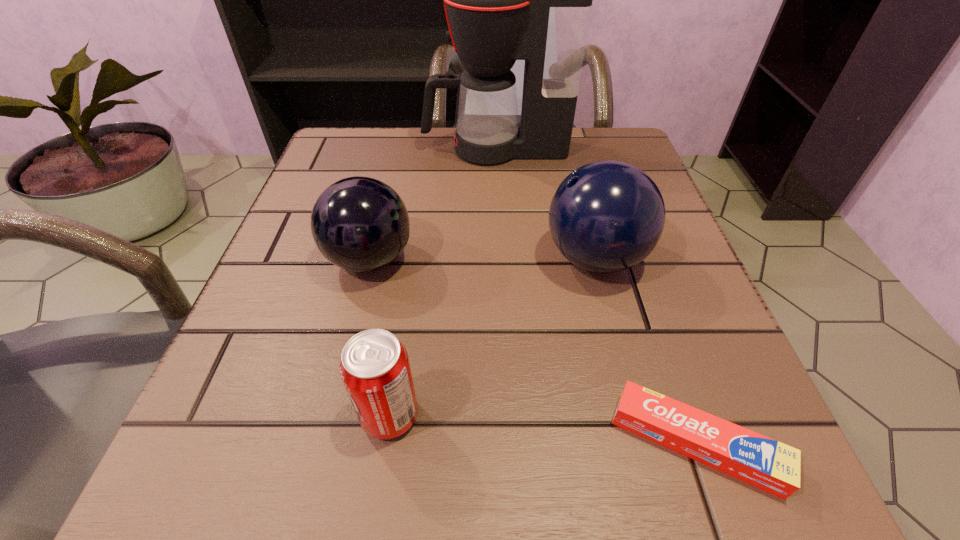
This screenshot has height=540, width=960. What are the coordinates of `the tallest object` in the screenshot? It's located at (505, 0).

Where is `the farthest object`? This screenshot has height=540, width=960. the farthest object is located at coordinates (505, 0).

The width and height of the screenshot is (960, 540). I want to click on the right bowling ball, so click(607, 216).

The height and width of the screenshot is (540, 960). I want to click on the left bowling ball, so click(360, 224).

Find the location of `soda`. soda is located at coordinates (374, 367).

Locate an element on the screen. This screenshot has height=540, width=960. the shortest object is located at coordinates (772, 466).

The height and width of the screenshot is (540, 960). I want to click on free space located 0.090m pour from the carafe of the coffee maker, so click(x=381, y=149).

Where is `free space located 0.140m pour from the carafe of the coffee maker`? The height and width of the screenshot is (540, 960). free space located 0.140m pour from the carafe of the coffee maker is located at coordinates (358, 149).

Identify the location of vacant point located 0.200m pour from the carafe of the coffee maker. (331, 149).

I want to click on free point located on the surface of the right bowling ball near the finger holes, so point(464,258).